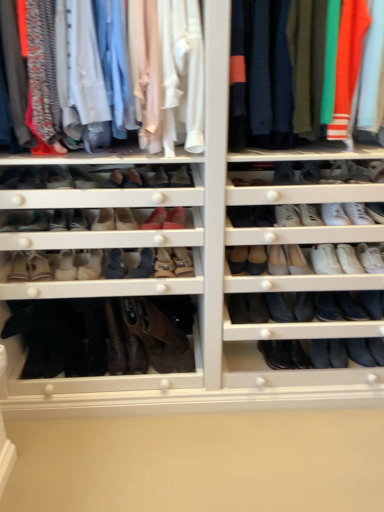
Question: Which direction should I rotate to look at suede beige boot at center, arranged as the 12th shoe when viewed from the right?

Choices:
 (A) left
 (B) right

Answer: (A)

Question: Is matte cotton shirts at upper left, which is the 1th clothing from left to right, taller than matte pink leather shoe at center, arranged as the 4th shoe when viewed from the left?

Choices:
 (A) no
 (B) yes

Answer: (B)

Question: Is matte cotton shirts at upper left, which is the 1th clothing from left to right, far away from matte pink leather shoe at center, marked as the eleventh shoe in a right-to-left arrangement?

Choices:
 (A) no
 (B) yes

Answer: (A)

Question: Is matte pink leather shoe at center, marked as the eleventh shoe in a right-to-left arrangement, a part of matte cotton shirts at upper left, which is the 2th clothing from right to left?

Choices:
 (A) no
 (B) yes

Answer: (A)

Question: Is matte cotton shirts at upper left, which is the 1th clothing from left to right, oriented away from matte pink leather shoe at center, arranged as the 4th shoe when viewed from the left?

Choices:
 (A) yes
 (B) no

Answer: (B)

Question: Is matte cotton shirts at upper left, which is the 1th clothing from left to right, next to matte pink leather shoe at center, arranged as the 4th shoe when viewed from the left, and touching it?

Choices:
 (A) no
 (B) yes

Answer: (A)

Question: From a real-world perspective, is matte cotton shirts at upper left, which is the 1th clothing from left to right, below matte pink leather shoe at center, arranged as the 4th shoe when viewed from the left?

Choices:
 (A) no
 (B) yes

Answer: (A)

Question: From a real-world perspective, is black leather boot at lower center, which is the 2th shoe in right-to-left order, located higher than suede brown boot at lower left, placed as the 2th shoe when sorted from left to right?

Choices:
 (A) yes
 (B) no

Answer: (B)

Question: From a real-world perspective, is black leather boot at lower center, the 13th shoe in the left-to-right sequence, under suede brown boot at lower left, which appears as the thirteenth shoe when viewed from the right?

Choices:
 (A) yes
 (B) no

Answer: (A)

Question: Can you confirm if black leather boot at lower center, the 13th shoe in the left-to-right sequence, is taller than suede brown boot at lower left, placed as the 2th shoe when sorted from left to right?

Choices:
 (A) yes
 (B) no

Answer: (B)

Question: Is black leather boot at lower center, which is the 2th shoe in right-to-left order, not close to suede brown boot at lower left, placed as the 2th shoe when sorted from left to right?

Choices:
 (A) yes
 (B) no

Answer: (A)

Question: Does black leather boot at lower center, the 13th shoe in the left-to-right sequence, appear on the right side of suede brown boot at lower left, placed as the 2th shoe when sorted from left to right?

Choices:
 (A) no
 (B) yes

Answer: (B)

Question: Can suede brown boot at lower left, which appears as the thirteenth shoe when viewed from the right, be found inside black leather boot at lower center, which is the 2th shoe in right-to-left order?

Choices:
 (A) no
 (B) yes

Answer: (A)

Question: Is knit sweater at upper right, which is the second clothing from left to right, turned away from suede beige boot at center, the third shoe viewed from the left?

Choices:
 (A) yes
 (B) no

Answer: (B)